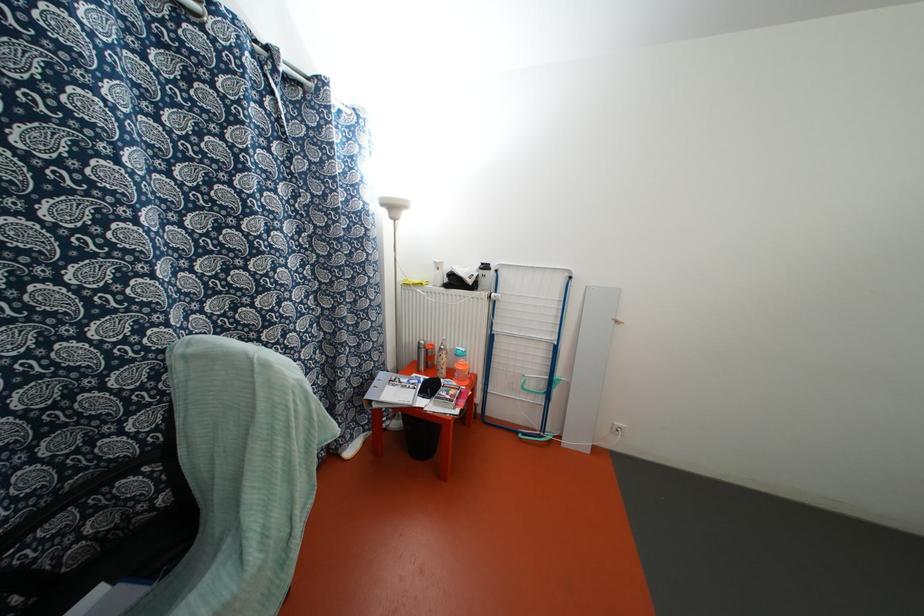
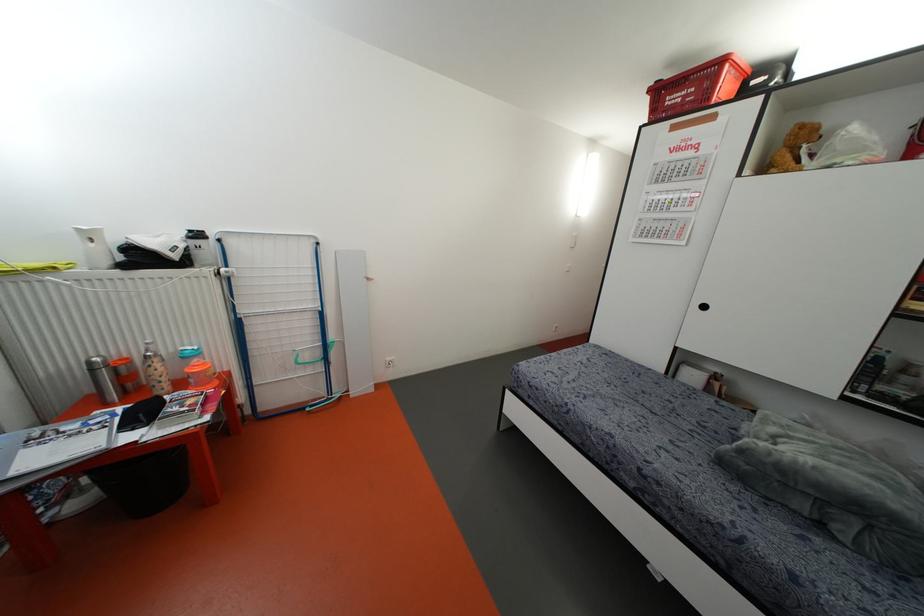
Find the pixel in the second image that matches the point at 419,347 in the first image.

(91, 370)